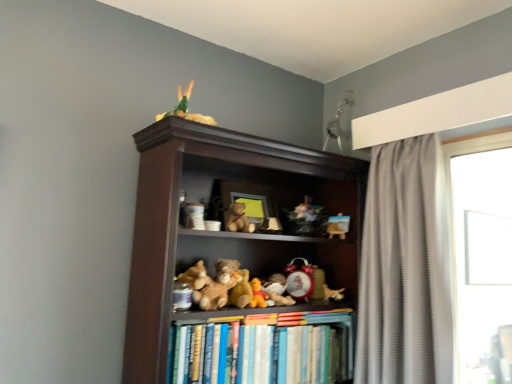
How much space does shiny red alarm clock at center, the seventh toy when ordered from left to right, occupy horizontally?

shiny red alarm clock at center, the seventh toy when ordered from left to right, is 4.84 inches in width.

The image size is (512, 384). In order to click on fluffy brown teddy bear at center, positioned as the 3th toy in left-to-right order in this screenshot , I will do pyautogui.click(x=236, y=283).

Locate an element on the screen. This screenshot has height=384, width=512. soft plush bear at center, which is the 6th toy from left to right is located at coordinates (277, 290).

Image resolution: width=512 pixels, height=384 pixels. What are the coordinates of `matte white ceramic cup at center, acting as the 1th toy starting from the left` in the screenshot? It's located at (194, 216).

Can you confirm if brown plush bear at center, which is the fourth toy in left-to-right order, is positioned to the right of soft plush bear at center, which is counted as the 2th toy, starting from the left?

Indeed, brown plush bear at center, which is the fourth toy in left-to-right order, is positioned on the right side of soft plush bear at center, which is counted as the 2th toy, starting from the left.

From the image's perspective, is brown plush bear at center, which ranks as the seventh toy in right-to-left order, below soft plush bear at center, the 9th toy from the right?

Indeed, from the image's perspective, brown plush bear at center, which ranks as the seventh toy in right-to-left order, is shown beneath soft plush bear at center, the 9th toy from the right.

Is brown plush bear at center, which is the fourth toy in left-to-right order, facing away from soft plush bear at center, which is counted as the 2th toy, starting from the left?

That's not correct — brown plush bear at center, which is the fourth toy in left-to-right order, is not looking away from soft plush bear at center, which is counted as the 2th toy, starting from the left.

Based on their sizes in the image, would you say brown plush bear at center, which ranks as the seventh toy in right-to-left order, is bigger or smaller than soft plush bear at center, which is counted as the 2th toy, starting from the left?

brown plush bear at center, which ranks as the seventh toy in right-to-left order, is smaller than soft plush bear at center, which is counted as the 2th toy, starting from the left.

Considering the relative positions of soft plush bear at center, which is the 5th toy in right-to-left order, and shiny red alarm clock at center, the 4th toy positioned from the right, in the image provided, is soft plush bear at center, which is the 5th toy in right-to-left order, to the left or to the right of shiny red alarm clock at center, the 4th toy positioned from the right,?

From the image, it's evident that soft plush bear at center, which is the 5th toy in right-to-left order, is to the left of shiny red alarm clock at center, the 4th toy positioned from the right.

From the image's perspective, relative to shiny red alarm clock at center, the seventh toy when ordered from left to right, is soft plush bear at center, which is the 6th toy from left to right, above or below?

soft plush bear at center, which is the 6th toy from left to right, is situated lower than shiny red alarm clock at center, the seventh toy when ordered from left to right, in the image.

Which of these two, soft plush bear at center, which is the 6th toy from left to right, or shiny red alarm clock at center, the seventh toy when ordered from left to right, is thinner?

Thinner between the two is shiny red alarm clock at center, the seventh toy when ordered from left to right.

Is soft plush bear at center, which is the 6th toy from left to right, in front of or behind shiny red alarm clock at center, the 4th toy positioned from the right, in the image?

In the image, soft plush bear at center, which is the 6th toy from left to right, appears in front of shiny red alarm clock at center, the 4th toy positioned from the right.

From the picture: From a real-world perspective, is wooden easel at upper center, which appears as the tenth toy when viewed from the left, positioned above or below matte white figurine at center, the sixth toy viewed from the right?

Clearly, from a real-world perspective, wooden easel at upper center, which appears as the tenth toy when viewed from the left, is above matte white figurine at center, the sixth toy viewed from the right.

Is wooden easel at upper center, which appears as the tenth toy when viewed from the left, positioned far away from matte white figurine at center, which is the 5th toy from left to right?

No, wooden easel at upper center, which appears as the tenth toy when viewed from the left, is not far away from matte white figurine at center, which is the 5th toy from left to right.

Which object is positioned more to the right, wooden easel at upper center, which appears as the 1th toy when viewed from the right, or matte white figurine at center, the sixth toy viewed from the right?

wooden easel at upper center, which appears as the 1th toy when viewed from the right, is more to the right.

Is wooden easel at upper center, which appears as the tenth toy when viewed from the left, oriented away from matte white figurine at center, which is the 5th toy from left to right?

No, wooden easel at upper center, which appears as the tenth toy when viewed from the left,'s orientation is not away from matte white figurine at center, which is the 5th toy from left to right.

Considering the sizes of objects matte white figurine at center, the sixth toy viewed from the right, and brown wooden bookcase at center in the image provided, who is taller, matte white figurine at center, the sixth toy viewed from the right, or brown wooden bookcase at center?

brown wooden bookcase at center.

Considering the points (270, 228) and (156, 141), which point is in front, point (270, 228) or point (156, 141)?

The point (156, 141) is closer to the camera.

What's the angular difference between matte white figurine at center, which is the 5th toy from left to right, and brown wooden bookcase at center's facing directions?

The facing directions of matte white figurine at center, which is the 5th toy from left to right, and brown wooden bookcase at center are 4.05 degrees apart.

Does matte white figurine at center, the sixth toy viewed from the right, touch brown wooden bookcase at center?

No, matte white figurine at center, the sixth toy viewed from the right, is not touching brown wooden bookcase at center.

Based on the photo, is hardcover books at center aimed at gray textured curtain at right?

No, hardcover books at center is not oriented towards gray textured curtain at right.

Looking at this image, can you confirm if hardcover books at center is thinner than gray textured curtain at right?

Correct, the width of hardcover books at center is less than that of gray textured curtain at right.

Considering the points (287, 332) and (421, 276), which point is in front, point (287, 332) or point (421, 276)?

Positioned in front is point (287, 332).

Locate an element on the screen. The image size is (512, 384). book located on the left of gray textured curtain at right is located at coordinates point(265,350).

From the image's perspective, relative to brown plush bear at center, which ranks as the seventh toy in right-to-left order, is wooden floral arrangement at center, placed as the 8th toy when sorted from left to right, above or below?

wooden floral arrangement at center, placed as the 8th toy when sorted from left to right, is above brown plush bear at center, which ranks as the seventh toy in right-to-left order.

Is the depth of wooden floral arrangement at center, placed as the 8th toy when sorted from left to right, greater than that of brown plush bear at center, which is the fourth toy in left-to-right order?

Yes, it is behind brown plush bear at center, which is the fourth toy in left-to-right order.

Considering the relative sizes of wooden floral arrangement at center, placed as the 8th toy when sorted from left to right, and brown plush bear at center, which is the fourth toy in left-to-right order, in the image provided, is wooden floral arrangement at center, placed as the 8th toy when sorted from left to right, taller than brown plush bear at center, which is the fourth toy in left-to-right order,?

Yes, wooden floral arrangement at center, placed as the 8th toy when sorted from left to right, is taller than brown plush bear at center, which is the fourth toy in left-to-right order.

In the scene shown: Considering the relative sizes of hardcover books at center and transparent glass window at right in the image provided, is hardcover books at center taller than transparent glass window at right?

Incorrect, the height of hardcover books at center is not larger of that of transparent glass window at right.

Between hardcover books at center and transparent glass window at right, which one appears on the left side from the viewer's perspective?

From the viewer's perspective, hardcover books at center appears more on the left side.

Is hardcover books at center looking in the opposite direction of transparent glass window at right?

No, hardcover books at center is not facing the opposite direction of transparent glass window at right.

In the image, there is a transparent glass window at right. Where is `book below it (from a real-world perspective)`? The width and height of the screenshot is (512, 384). book below it (from a real-world perspective) is located at coordinates (265, 350).

Find the location of a particular element. The width and height of the screenshot is (512, 384). the 2nd toy behind the soft plush bear at center, which is counted as the 2th toy, starting from the left, counting from the anchor's position is located at coordinates (258, 295).

The height and width of the screenshot is (384, 512). Identify the location of the 1st toy positioned below the shiny red alarm clock at center, the seventh toy when ordered from left to right (from the image's perspective). (277, 290).

Considering their positions, is gray textured curtain at right positioned further to wooden easel at upper center, which appears as the 1th toy when viewed from the right, than soft plush dog at center, arranged as the second toy when viewed from the right?

gray textured curtain at right is positioned further to the anchor wooden easel at upper center, which appears as the 1th toy when viewed from the right.

Which object lies nearer to the anchor point soft plush bear at center, which is the 6th toy from left to right, brown plush bear at center, which ranks as the seventh toy in right-to-left order, or matte white figurine at center, the sixth toy viewed from the right?

The object closer to soft plush bear at center, which is the 6th toy from left to right, is brown plush bear at center, which ranks as the seventh toy in right-to-left order.

Estimate the real-world distances between objects in this image. Which object is closer to fluffy brown teddy bear at center, positioned as the 3th toy in left-to-right order, brown plush bear at center or matte white ceramic cup at center, placed as the tenth toy when sorted from right to left?

brown plush bear at center.

Which object lies nearer to the anchor point shiny red alarm clock at center, the 4th toy positioned from the right, brown plush bear at center or hardcover books at center?

Among the two, hardcover books at center is located nearer to shiny red alarm clock at center, the 4th toy positioned from the right.

Consider the image. When comparing their distances from matte white ceramic cup at center, placed as the tenth toy when sorted from right to left, does fluffy brown teddy bear at center, positioned as the 3th toy in left-to-right order, or gray textured curtain at right seem closer?

fluffy brown teddy bear at center, positioned as the 3th toy in left-to-right order, lies closer to matte white ceramic cup at center, placed as the tenth toy when sorted from right to left, than the other object.

Considering their positions, is transparent glass window at right positioned closer to matte white ceramic cup at center, acting as the 1th toy starting from the left, than brown plush bear at center?

brown plush bear at center lies closer to matte white ceramic cup at center, acting as the 1th toy starting from the left, than the other object.

From the image, which object appears to be farther from shiny red alarm clock at center, the 4th toy positioned from the right, brown plush bear at center or transparent glass window at right?

transparent glass window at right is positioned further to the anchor shiny red alarm clock at center, the 4th toy positioned from the right.

From the image, which object appears to be nearer to wooden easel at upper center, which appears as the tenth toy when viewed from the left, wooden floral arrangement at center, placed as the 8th toy when sorted from left to right, or soft plush dog at center, which ranks as the ninth toy in left-to-right order?

The object closer to wooden easel at upper center, which appears as the tenth toy when viewed from the left, is wooden floral arrangement at center, placed as the 8th toy when sorted from left to right.

Find the location of a particular element. The width and height of the screenshot is (512, 384). animal between soft plush bear at center, the 9th toy from the right, and soft plush dog at center, which ranks as the ninth toy in left-to-right order, from left to right is located at coordinates (237, 219).

Identify the location of bookcase between soft plush bear at center, which is counted as the 2th toy, starting from the left, and transparent glass window at right from left to right. (234, 258).

Where is `bookcase between brown plush bear at center and hardcover books at center vertically`? bookcase between brown plush bear at center and hardcover books at center vertically is located at coordinates (234, 258).

Locate an element on the screen. The height and width of the screenshot is (384, 512). animal located between brown wooden bookcase at center and matte white figurine at center, which is the 5th toy from left to right, in the depth direction is located at coordinates (237, 219).